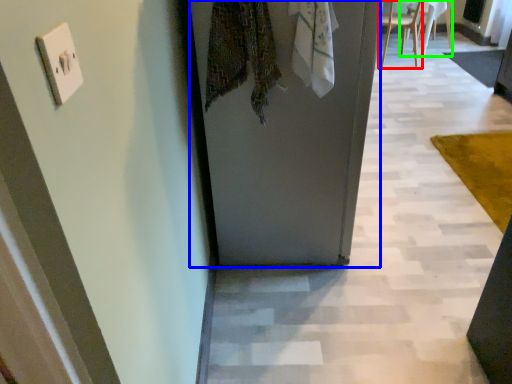
Question: Which is nearer to the chair (highlighted by a red box)? door (highlighted by a blue box) or chair (highlighted by a green box).

Choices:
 (A) door
 (B) chair

Answer: (B)